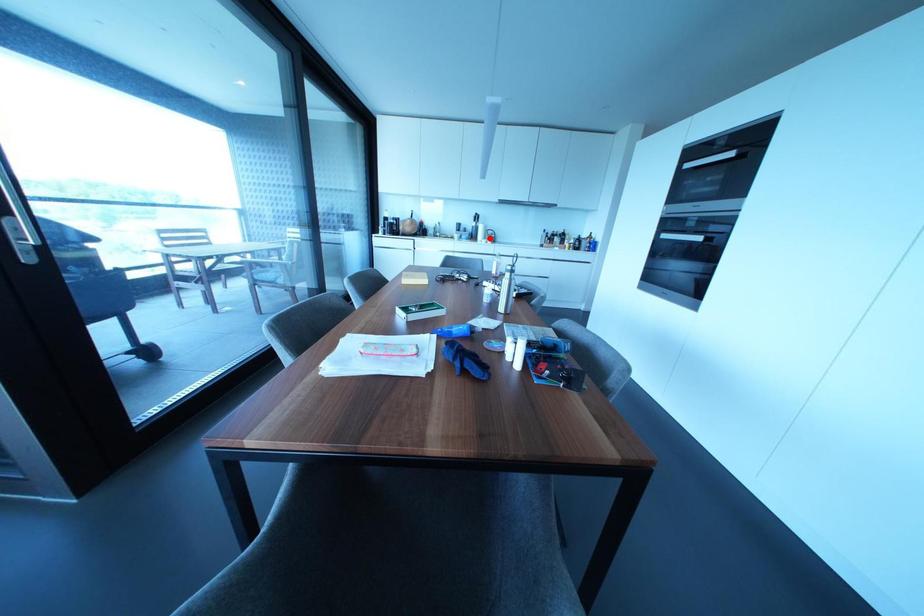
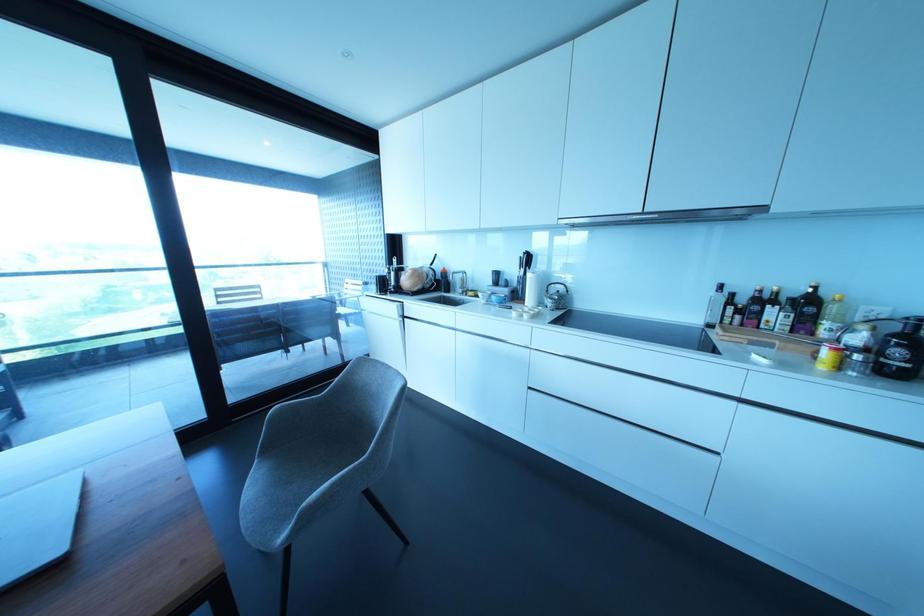
In the second image, find the point that corresponds to the highlighted location in the first image.

(549, 302)